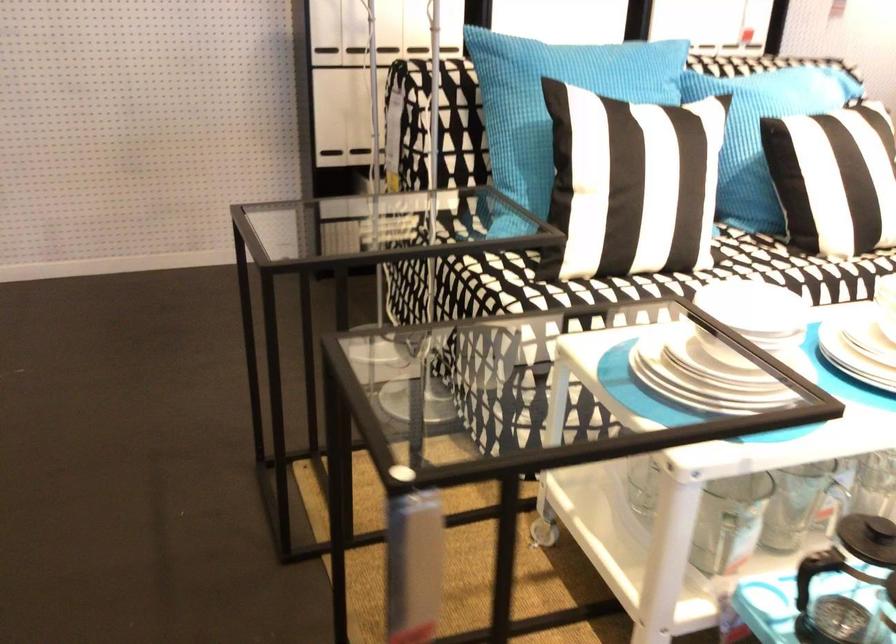
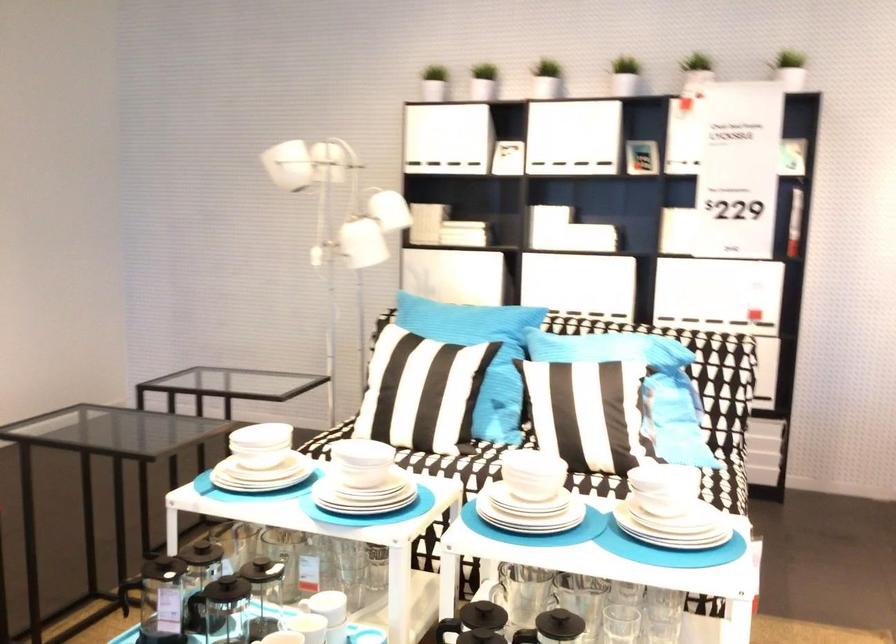
Locate, in the second image, the point that corresponds to (x=623, y=175) in the first image.

(398, 377)